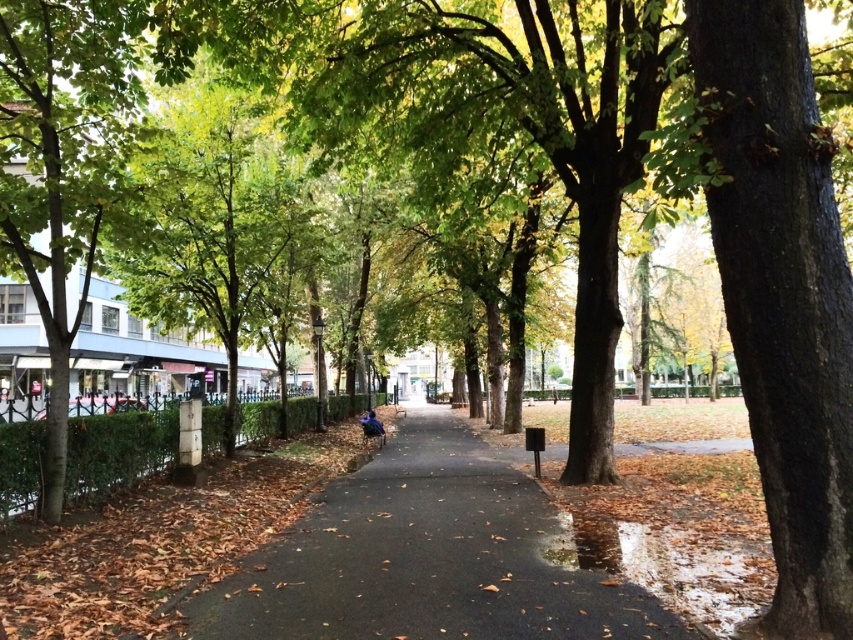
Question: Is brown rough bark tree at right wider than black asphalt pavement at center?

Choices:
 (A) no
 (B) yes

Answer: (A)

Question: Which point appears farthest from the camera in this image?

Choices:
 (A) click(x=495, y=524)
 (B) click(x=364, y=426)
 (C) click(x=796, y=627)
 (D) click(x=363, y=417)

Answer: (D)

Question: Is brown rough bark tree at right to the left of metallic blue bench at center from the viewer's perspective?

Choices:
 (A) no
 (B) yes

Answer: (A)

Question: Which object appears farthest from the camera in this image?

Choices:
 (A) blue fabric at center
 (B) metallic blue bench at center
 (C) brown rough bark tree at right
 (D) black asphalt pavement at center

Answer: (A)

Question: Which of the following is the closest to the observer?

Choices:
 (A) (740, 275)
 (B) (373, 426)
 (C) (369, 433)
 (D) (265, 600)

Answer: (A)

Question: Does brown rough bark tree at right have a smaller size compared to black asphalt pavement at center?

Choices:
 (A) no
 (B) yes

Answer: (B)